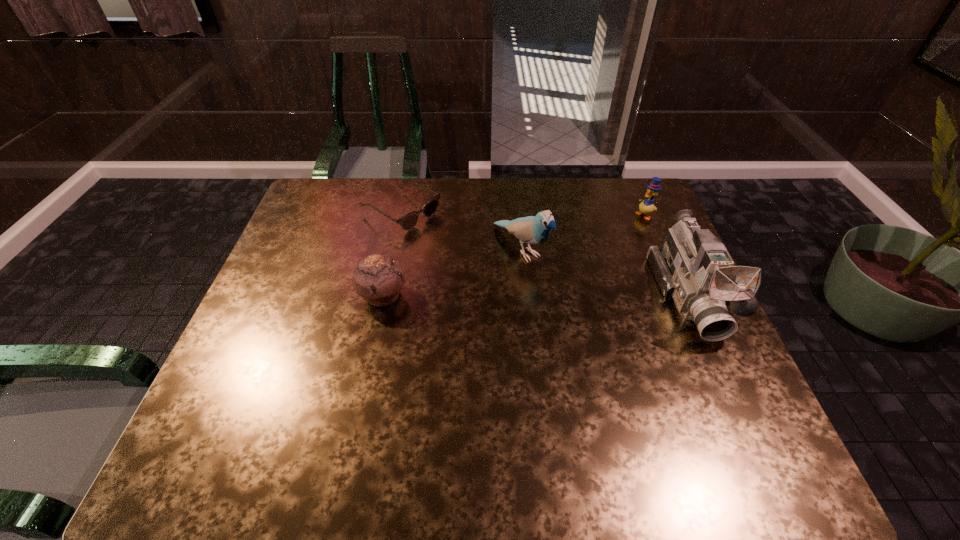
Locate an element on the screen. The image size is (960, 540). muffin is located at coordinates (378, 279).

Locate an element on the screen. Image resolution: width=960 pixels, height=540 pixels. camcorder is located at coordinates (693, 267).

What are the coordinates of `bird` in the screenshot? It's located at (536, 229).

Find the location of a particular element. the shortest object is located at coordinates (407, 222).

Locate an element on the screen. Image resolution: width=960 pixels, height=540 pixels. duckling is located at coordinates (646, 206).

Image resolution: width=960 pixels, height=540 pixels. I want to click on vacant space situated 0.210m on the front of the muffin, so click(x=363, y=390).

You are a GUI agent. You are given a task and a screenshot of the screen. Output one action in this format:
    pyautogui.click(x=<x>, y=<y>)
    Task: Click on the free space located 0.120m on the front-facing side of the camcorder
    
    Given the screenshot: What is the action you would take?
    pyautogui.click(x=732, y=394)

Where is `vacant space located 0.230m at the face of the third object from left to right`? This screenshot has width=960, height=540. vacant space located 0.230m at the face of the third object from left to right is located at coordinates (600, 326).

The width and height of the screenshot is (960, 540). Find the location of `vacant region located at the face of the third object from left to right`. vacant region located at the face of the third object from left to right is located at coordinates (600, 326).

Locate an element on the screen. The image size is (960, 540). blank space located 0.160m at the face of the third object from left to right is located at coordinates (580, 307).